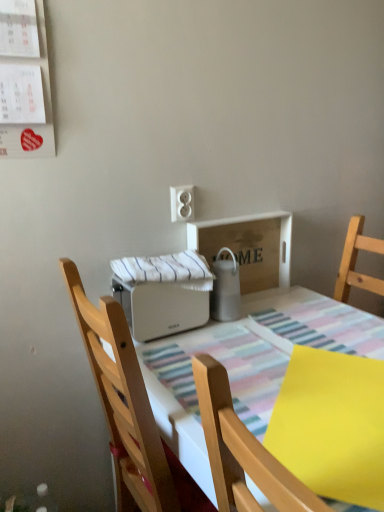
Locate an element on the screen. empty space that is to the right of wooden tray at center is located at coordinates (294, 307).